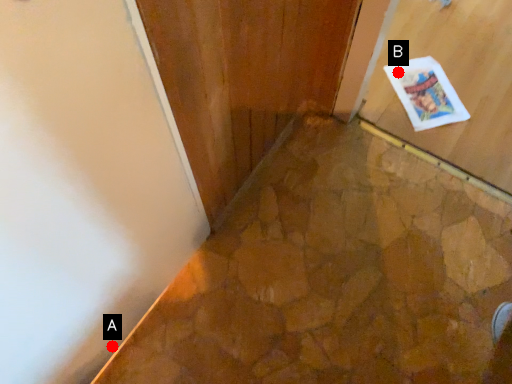
Question: Two points are circled on the image, labeled by A and B beside each circle. Which of the following is the closest to the observer?

Choices:
 (A) A is closer
 (B) B is closer

Answer: (A)